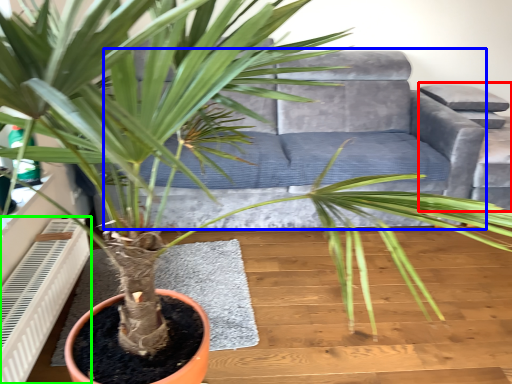
Question: Estimate the real-world distances between objects in this image. Which object is farther from armchair (highlighted by a red box), couch (highlighted by a blue box) or air conditioner (highlighted by a green box)?

Choices:
 (A) couch
 (B) air conditioner

Answer: (B)